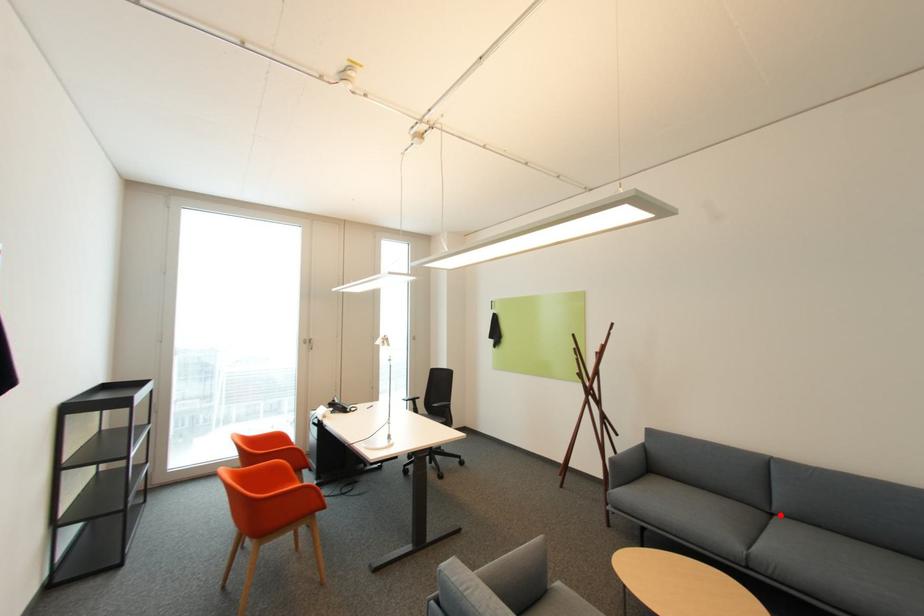
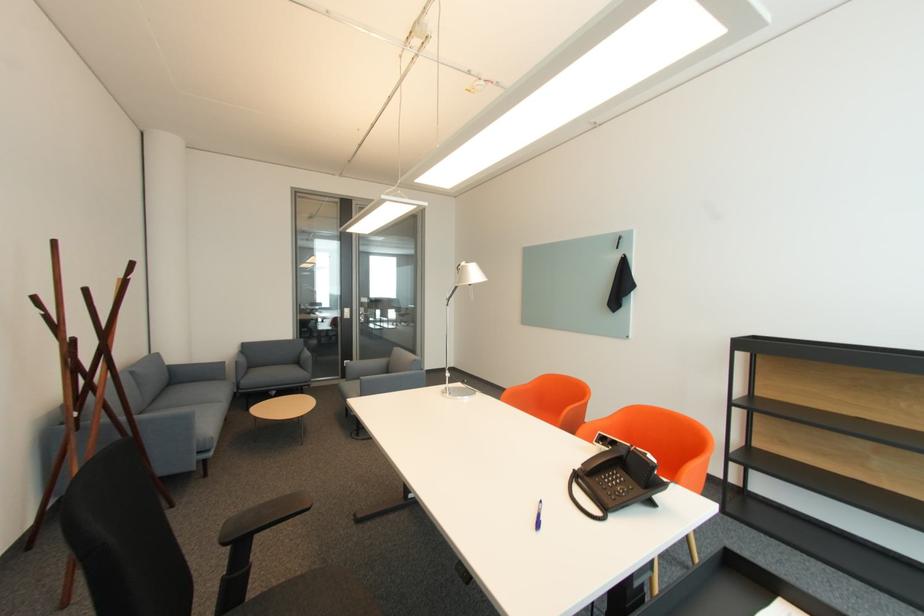
Question: I am providing you with two images of the same scene from different viewpoints. Image1 has a red point marked. In image2, the corresponding 3D location appears at what relative position? Reply with the corresponding letter.

Choices:
 (A) Closer
 (B) Farther

Answer: (B)